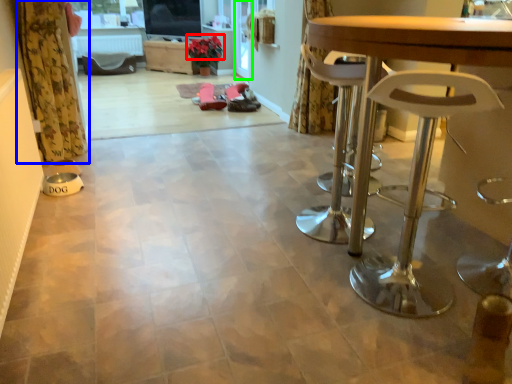
Question: Estimate the real-world distances between objects in this image. Which object is farther from flower (highlighted by a red box), curtain (highlighted by a blue box) or screen door (highlighted by a green box)?

Choices:
 (A) curtain
 (B) screen door

Answer: (A)